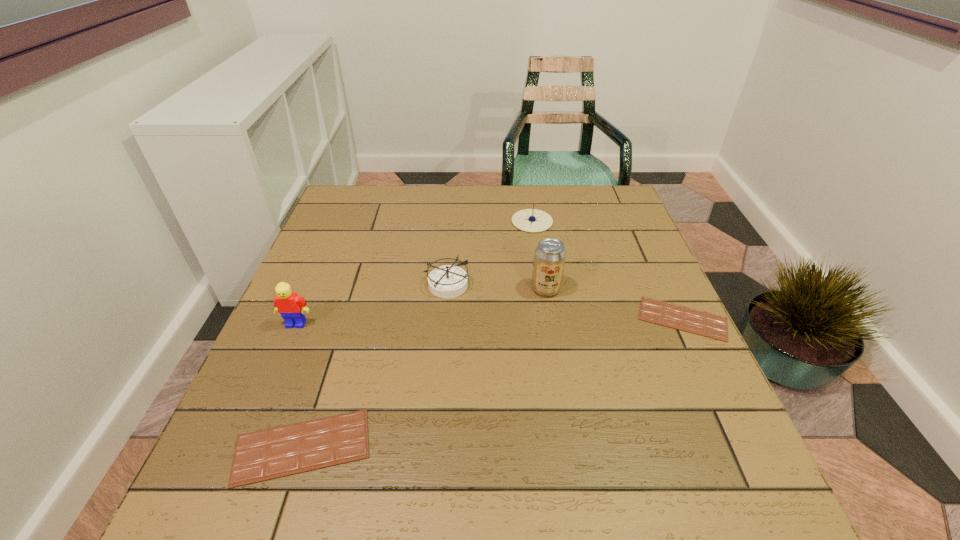
Identify the location of the nearer chocolate bar. Image resolution: width=960 pixels, height=540 pixels. (277, 452).

Locate an element on the screen. The image size is (960, 540). the second shortest object is located at coordinates (277, 452).

Where is `the farther chocolate bar`? the farther chocolate bar is located at coordinates (691, 320).

Where is `the shortest object`? Image resolution: width=960 pixels, height=540 pixels. the shortest object is located at coordinates (691, 320).

Where is `the right compass`? The width and height of the screenshot is (960, 540). the right compass is located at coordinates (x=530, y=220).

Find the location of a particular element. the farther compass is located at coordinates (530, 220).

Identify the location of the left compass. The image size is (960, 540). (448, 281).

Identify the location of the fourth object from right to left. This screenshot has width=960, height=540. (448, 281).

This screenshot has height=540, width=960. I want to click on Lego, so click(291, 306).

The width and height of the screenshot is (960, 540). In order to click on beer can in this screenshot , I will do `click(549, 258)`.